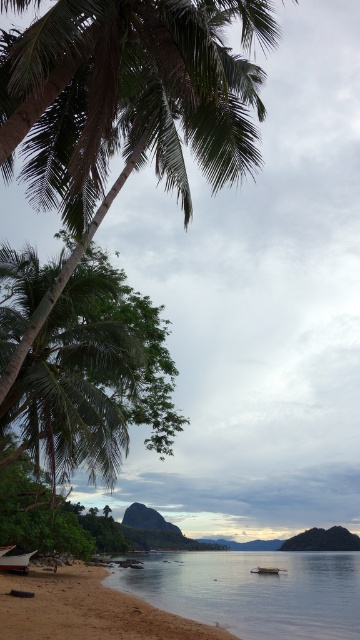
Question: Can you confirm if brown sandy beach at lower left is thinner than wooden boat at lower center?

Choices:
 (A) no
 (B) yes

Answer: (A)

Question: Which point is closer to the camera taking this photo?

Choices:
 (A) (9, 570)
 (B) (12, 584)
 (C) (263, 566)

Answer: (B)

Question: Which object is closer to the camera taking this photo?

Choices:
 (A) brown sandy beach at lower left
 (B) clear water at lower center
 (C) wooden boat at lower center
 (D) wooden boat at lower left

Answer: (A)

Question: Which point is closer to the camera?

Choices:
 (A) (187, 573)
 (B) (77, 620)
 (C) (18, 570)

Answer: (B)

Question: Is brown sandy beach at lower left closer to the viewer compared to wooden boat at lower left?

Choices:
 (A) yes
 (B) no

Answer: (A)

Question: Can you confirm if brown sandy beach at lower left is wider than wooden boat at lower left?

Choices:
 (A) yes
 (B) no

Answer: (A)